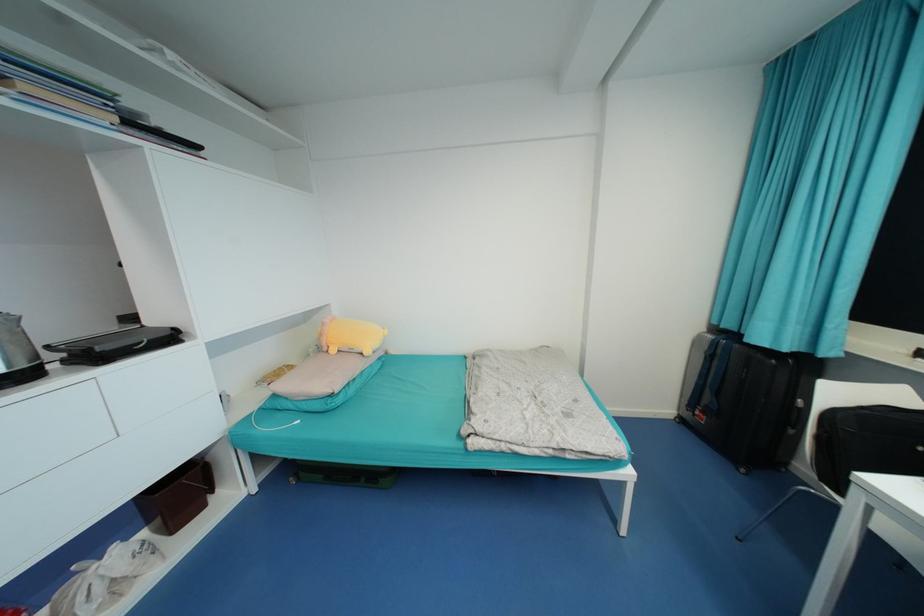
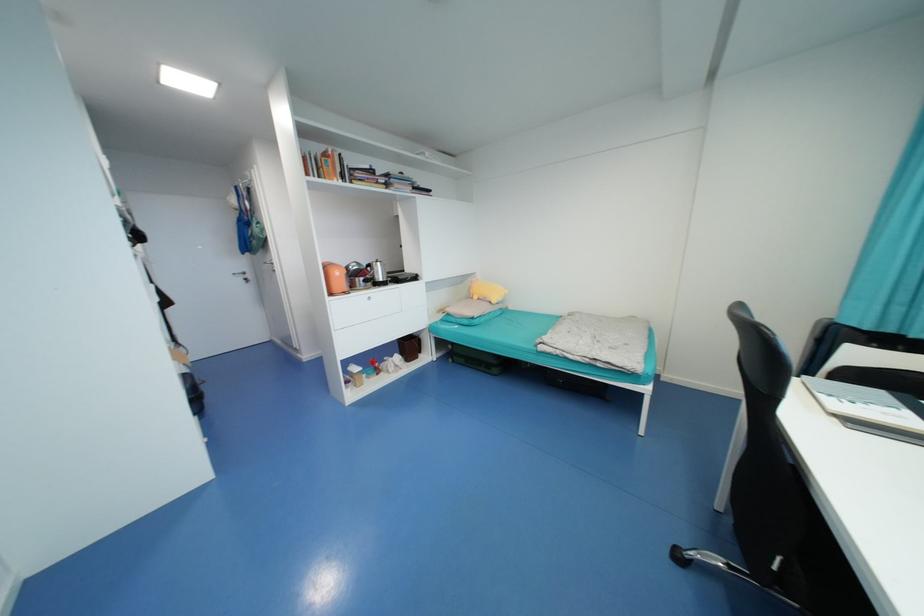
Question: The camera is either moving clockwise (left) or counter-clockwise (right) around the object. The first image is from the beginning of the video and the second image is from the end. Is the camera moving left or right when shooting the video?

Choices:
 (A) Left
 (B) Right

Answer: (B)